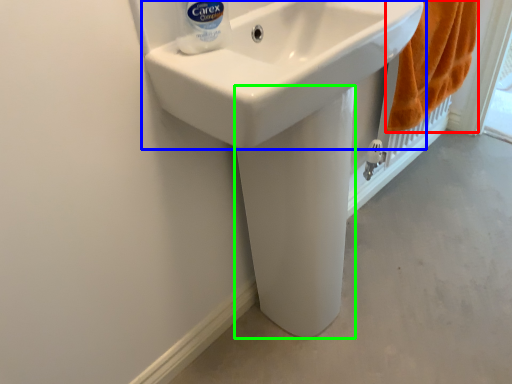
Question: Which object is the closest to the bath towel (highlighted by a red box)? Choose among these: sink (highlighted by a blue box) or bidet (highlighted by a green box).

Choices:
 (A) sink
 (B) bidet

Answer: (A)